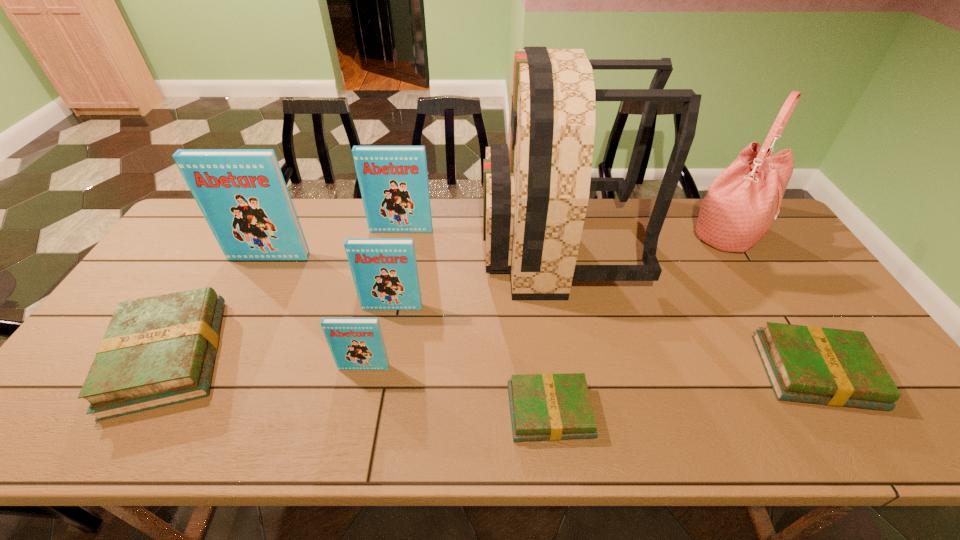
Image resolution: width=960 pixels, height=540 pixels. I want to click on book that is the fifth closest to the backpack, so click(356, 343).

Select which book is the second closest to the second nearest blue book. Please provide its 2D coordinates. Your answer should be formatted as a tuple, i.e. [(x, y)], where the tuple contains the x and y coordinates of a point satisfying the conditions above.

[(242, 194)]

Identify which blue book is located as the nearest to the second smallest blue book. Please provide its 2D coordinates. Your answer should be formatted as a tuple, i.e. [(x, y)], where the tuple contains the x and y coordinates of a point satisfying the conditions above.

[(356, 343)]

Locate which blue book ranks third in proximity to the eighth tallest object. Please provide its 2D coordinates. Your answer should be formatted as a tuple, i.e. [(x, y)], where the tuple contains the x and y coordinates of a point satisfying the conditions above.

[(393, 180)]

Locate which yellow book ranks second in proximity to the second tallest object. Please provide its 2D coordinates. Your answer should be formatted as a tuple, i.e. [(x, y)], where the tuple contains the x and y coordinates of a point satisfying the conditions above.

[(544, 407)]

This screenshot has width=960, height=540. Find the location of `yellow book that is the second nearest to the fifth shortest object`. yellow book that is the second nearest to the fifth shortest object is located at coordinates (544, 407).

Image resolution: width=960 pixels, height=540 pixels. In order to click on blank area in the image that satisfies the following two spatial constraints: 1. on the front cover of the fourth tallest book; 2. on the left side of the sixth book from left to right in this screenshot , I will do `click(354, 411)`.

Image resolution: width=960 pixels, height=540 pixels. Find the location of `vacant space that satisfies the following two spatial constraints: 1. on the front cover of the third tallest book; 2. on the left side of the second yellow book from left to right`. vacant space that satisfies the following two spatial constraints: 1. on the front cover of the third tallest book; 2. on the left side of the second yellow book from left to right is located at coordinates (372, 411).

In order to click on free spot that satisfies the following two spatial constraints: 1. on the front cover of the sixth tallest book; 2. on the right side of the sixth shortest book in this screenshot , I will do `click(372, 372)`.